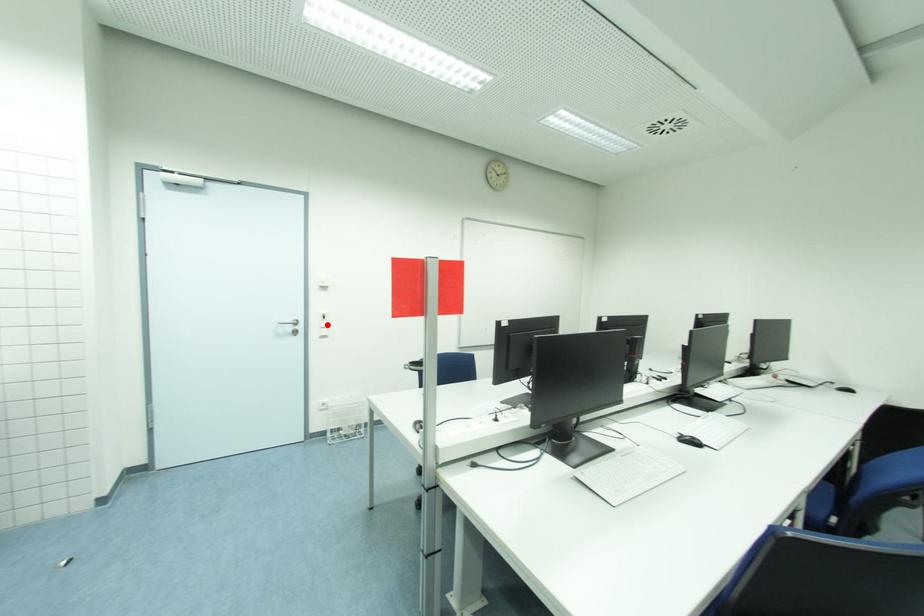
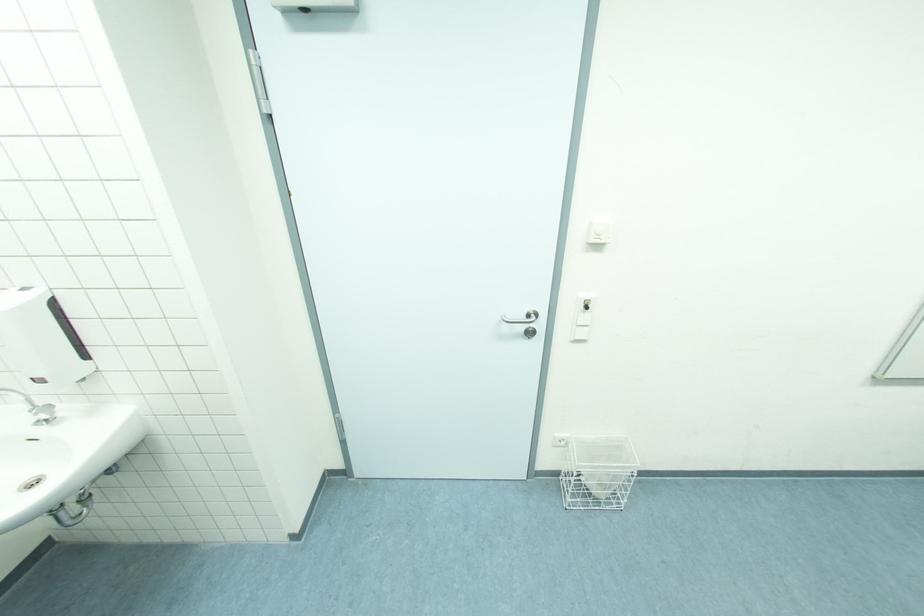
Find the pixel in the second image that matches the highlighted location in the first image.

(589, 318)